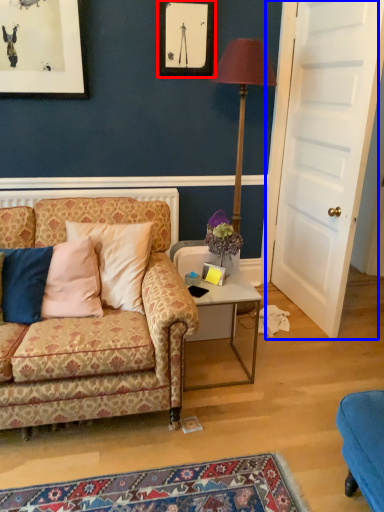
Question: Which of the following is the farthest to the observer, picture frame (highlighted by a red box) or door (highlighted by a blue box)?

Choices:
 (A) picture frame
 (B) door

Answer: (A)